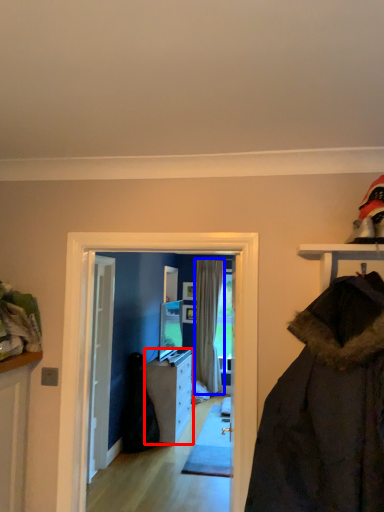
Question: Which point is further to the camera, cabinetry (highlighted by a red box) or curtain (highlighted by a blue box)?

Choices:
 (A) cabinetry
 (B) curtain

Answer: (B)